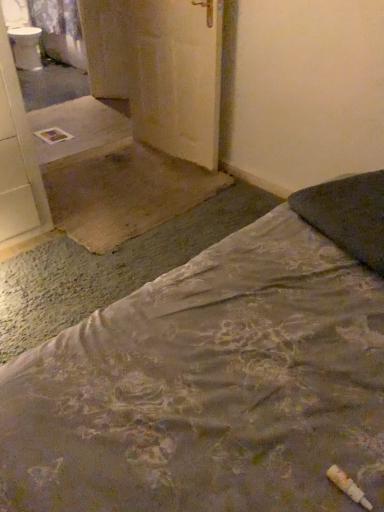
Question: From the image's perspective, does white glossy sink at upper left appear lower than floral fabric bed at lower right?

Choices:
 (A) no
 (B) yes

Answer: (A)

Question: Does white glossy sink at upper left turn towards floral fabric bed at lower right?

Choices:
 (A) yes
 (B) no

Answer: (A)

Question: From a real-world perspective, does white glossy sink at upper left sit lower than floral fabric bed at lower right?

Choices:
 (A) no
 (B) yes

Answer: (B)

Question: Is white glossy sink at upper left smaller than floral fabric bed at lower right?

Choices:
 (A) no
 (B) yes

Answer: (B)

Question: Is white glossy sink at upper left far from floral fabric bed at lower right?

Choices:
 (A) no
 (B) yes

Answer: (B)

Question: From a real-world perspective, relative to matte yellow door at center, is floral fabric bed at lower right vertically above or below?

Choices:
 (A) below
 (B) above

Answer: (B)

Question: In terms of width, does floral fabric bed at lower right look wider or thinner when compared to matte yellow door at center?

Choices:
 (A) wide
 (B) thin

Answer: (A)

Question: Would you say floral fabric bed at lower right is to the left or to the right of matte yellow door at center in the picture?

Choices:
 (A) right
 (B) left

Answer: (A)

Question: Is floral fabric bed at lower right in front of or behind matte yellow door at center in the image?

Choices:
 (A) front
 (B) behind

Answer: (A)

Question: Based on their sizes in the image, would you say white glossy sink at upper left is bigger or smaller than matte yellow door at center?

Choices:
 (A) small
 (B) big

Answer: (B)

Question: Is white glossy sink at upper left in front of or behind matte yellow door at center in the image?

Choices:
 (A) front
 (B) behind

Answer: (B)

Question: Which is correct: white glossy sink at upper left is inside matte yellow door at center, or outside of it?

Choices:
 (A) inside
 (B) outside

Answer: (B)

Question: From a real-world perspective, is white glossy sink at upper left positioned above or below matte yellow door at center?

Choices:
 (A) below
 (B) above

Answer: (A)

Question: From their relative heights in the image, would you say dark gray fabric pillow at upper right is taller or shorter than floral fabric bed at lower right?

Choices:
 (A) short
 (B) tall

Answer: (A)

Question: From a real-world perspective, is dark gray fabric pillow at upper right physically located above or below floral fabric bed at lower right?

Choices:
 (A) above
 (B) below

Answer: (A)